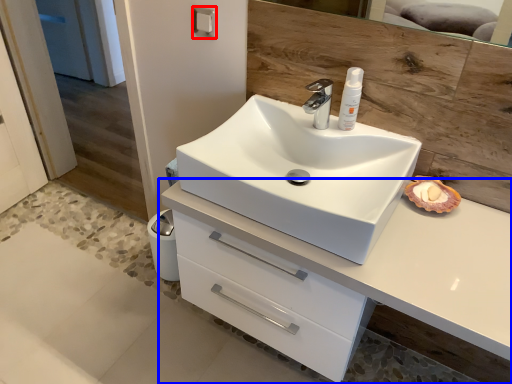
Question: Which of the following is the farthest to the observer, towel bar (highlighted by a red box) or bathroom cabinet (highlighted by a blue box)?

Choices:
 (A) towel bar
 (B) bathroom cabinet

Answer: (A)